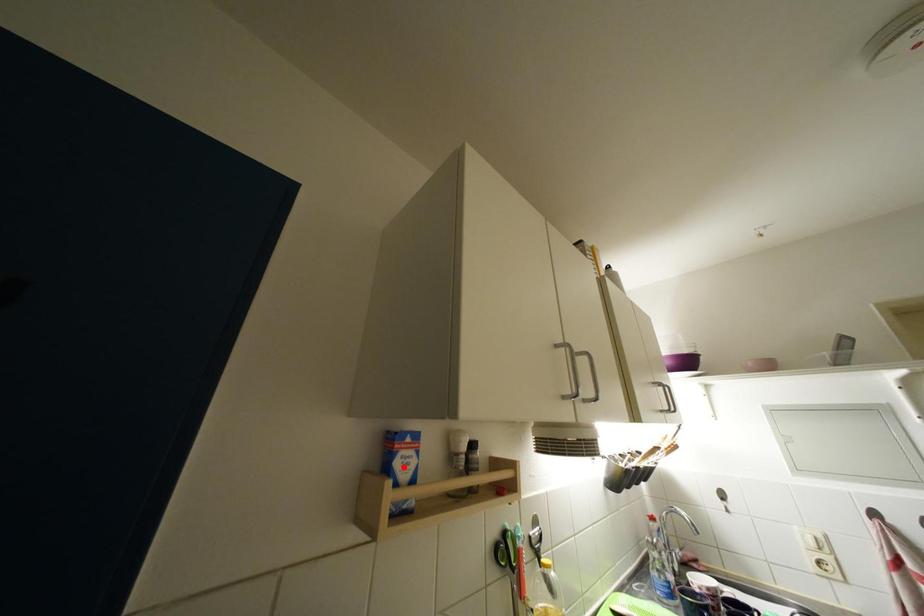
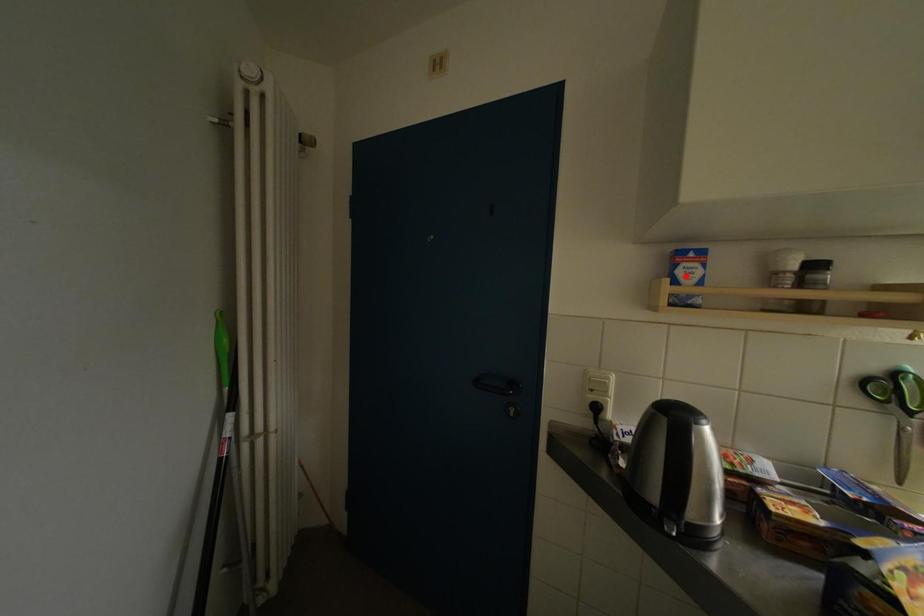
I am providing you with two images of the same scene from different viewpoints. A red point is marked on the first image and another point is marked on the second image. Is the red point in image1 aligned with the point shown in image2?

Yes